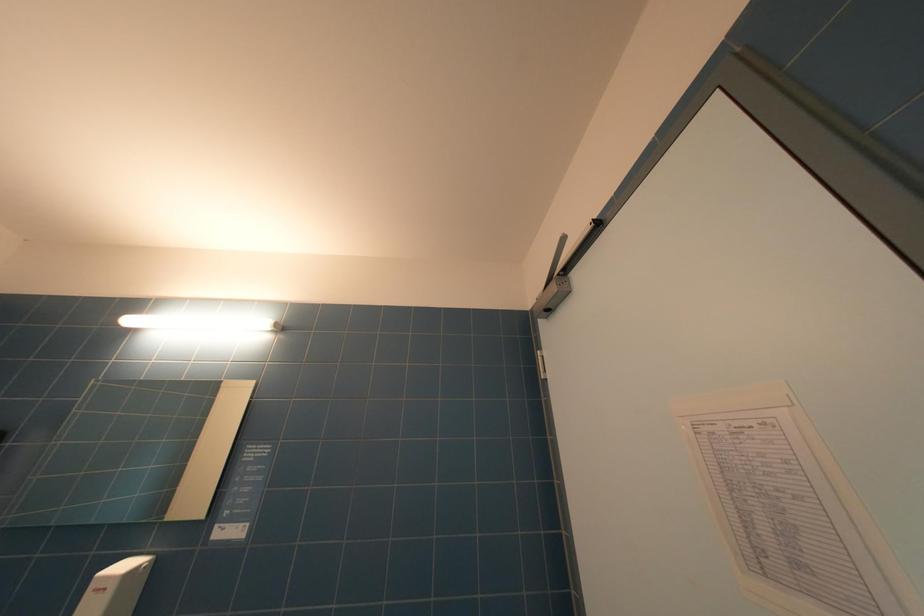
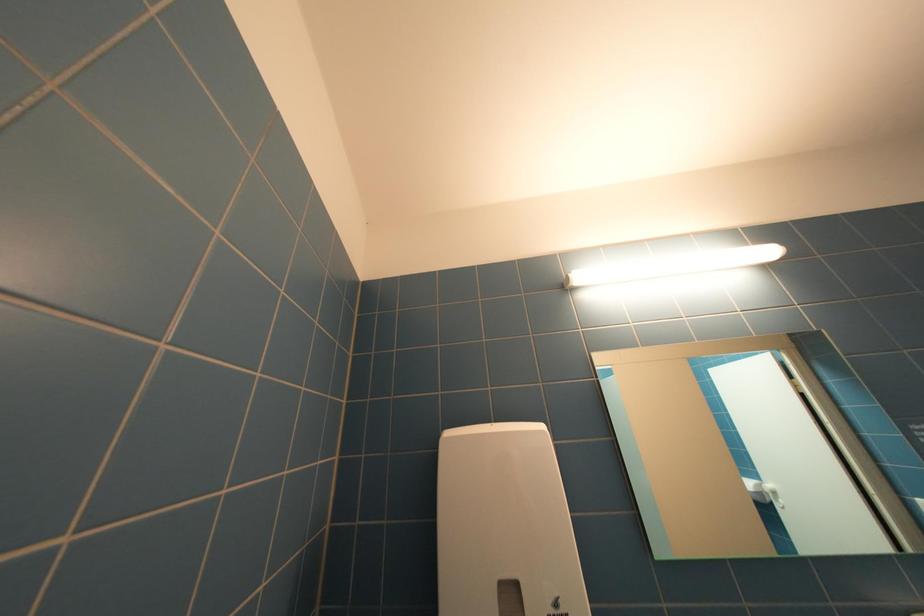
Question: In a continuous first-person perspective shot, in which direction is the camera moving?

Choices:
 (A) Left
 (B) Right
 (C) Forward
 (D) Backward

Answer: (A)